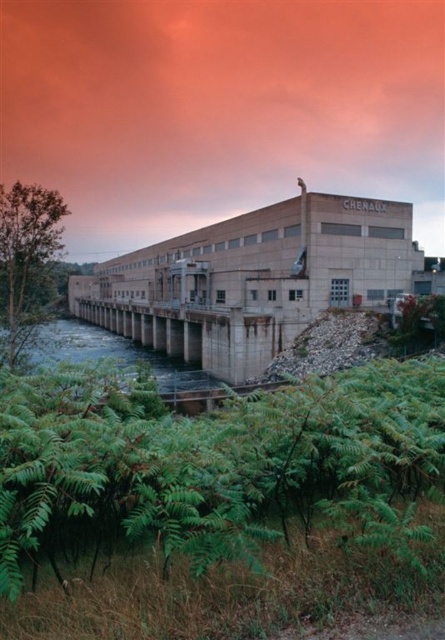
You are standing in front of the hydroelectric power station named CHERAUX. You see a point marked at coordinates (205, 460). What is located at that point?

The point at coordinates (205, 460) indicates green leafy shrubs at lower left.

You are a landscape designer planning to add more plants to the area around the hydroelectric power station. You have two options to consider based on the image provided. Which object, the green leafy shrubs at lower left or the clear concrete dam at center, would require more space if you want to plant additional shrubs of the same size next to them?

The clear concrete dam at center requires more space because the green leafy shrubs at lower left are smaller than the clear concrete dam at center, meaning the dam occupies a larger area where plants would need more room to be placed around it.